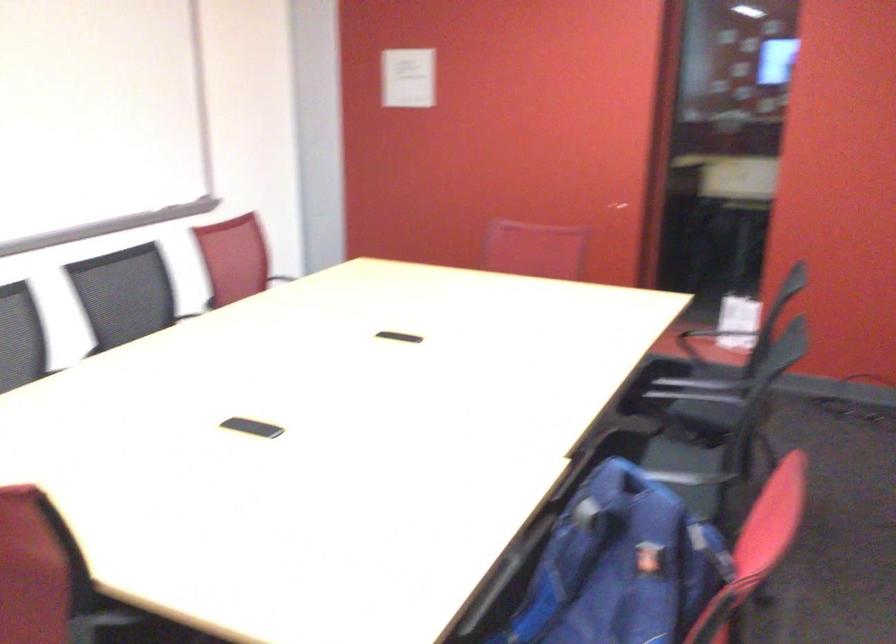
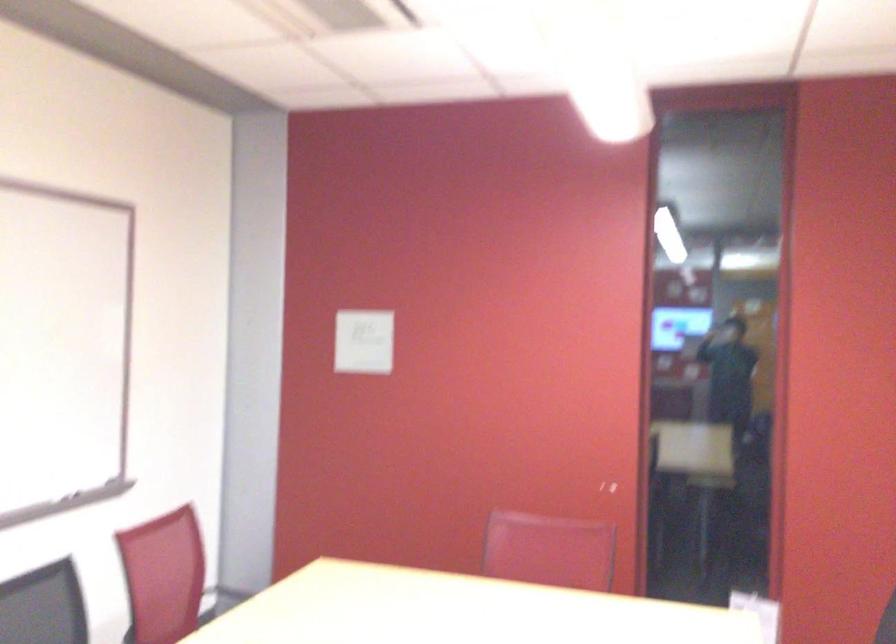
Question: Based on the continuous images, in which direction is the camera rotating? Reply with the corresponding letter.

Choices:
 (A) Left
 (B) Right
 (C) Up
 (D) Down

Answer: (C)